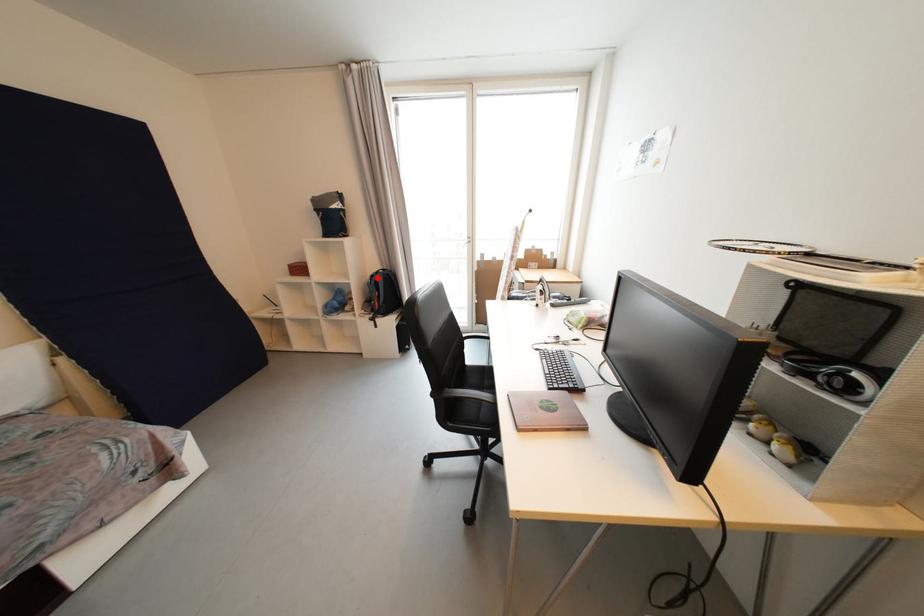
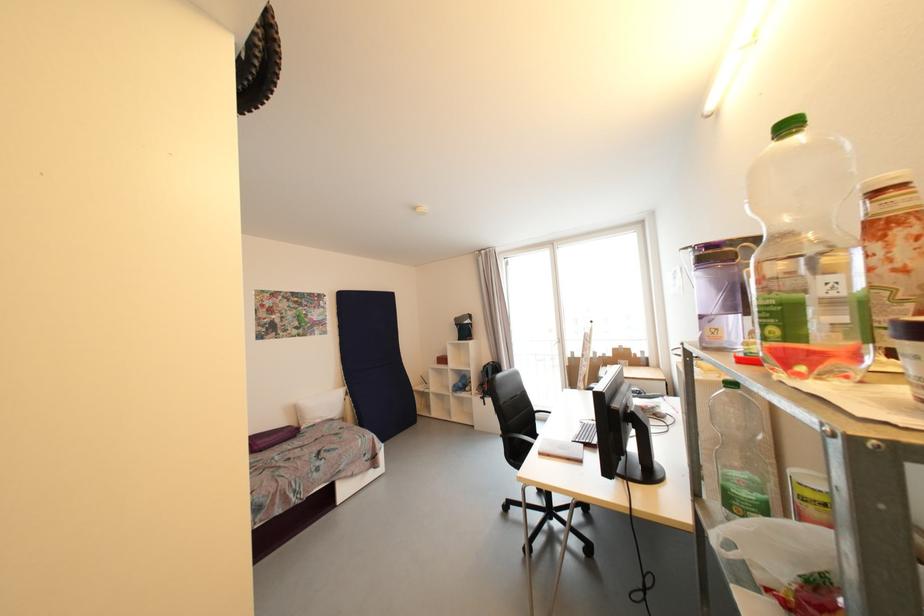
Find the pixel in the second image that matches the highlighted location in the first image.

(490, 368)